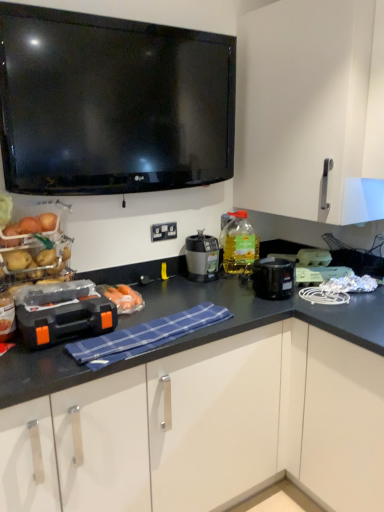
Question: In which direction should I rotate to look at orange plastic toolbox at center, which is counted as the first appliance, starting from the front?

Choices:
 (A) right
 (B) left

Answer: (B)

Question: Does white plastic electric outlet at center come in front of green plastic toaster at center, positioned as the third appliance in left-to-right order?

Choices:
 (A) yes
 (B) no

Answer: (B)

Question: Is white plastic electric outlet at center thinner than green plastic toaster at center, placed as the 1th appliance when sorted from right to left?

Choices:
 (A) no
 (B) yes

Answer: (B)

Question: Is white plastic electric outlet at center turned away from green plastic toaster at center, acting as the second appliance starting from the front?

Choices:
 (A) no
 (B) yes

Answer: (A)

Question: Could you tell me if white plastic electric outlet at center is facing green plastic toaster at center, acting as the second appliance starting from the front?

Choices:
 (A) yes
 (B) no

Answer: (B)

Question: Can you confirm if white plastic electric outlet at center is shorter than green plastic toaster at center, placed as the 1th appliance when sorted from right to left?

Choices:
 (A) no
 (B) yes

Answer: (A)

Question: From the image's perspective, is white plastic electric outlet at center located above green plastic toaster at center, which ranks as the 2th appliance in back-to-front order?

Choices:
 (A) yes
 (B) no

Answer: (A)

Question: Does white plastic electric outlet at center touch blue checkered cloth at center?

Choices:
 (A) no
 (B) yes

Answer: (A)

Question: Does white plastic electric outlet at center lie in front of blue checkered cloth at center?

Choices:
 (A) no
 (B) yes

Answer: (A)

Question: Is white plastic electric outlet at center facing away from blue checkered cloth at center?

Choices:
 (A) no
 (B) yes

Answer: (A)

Question: From the image's perspective, would you say white plastic electric outlet at center is positioned over blue checkered cloth at center?

Choices:
 (A) no
 (B) yes

Answer: (B)

Question: Could you tell me if white plastic electric outlet at center is turned towards blue checkered cloth at center?

Choices:
 (A) no
 (B) yes

Answer: (A)

Question: Considering the relative sizes of white plastic electric outlet at center and blue checkered cloth at center in the image provided, is white plastic electric outlet at center shorter than blue checkered cloth at center?

Choices:
 (A) yes
 (B) no

Answer: (B)

Question: Is matte black blender at center oriented towards blue checkered cloth at center?

Choices:
 (A) yes
 (B) no

Answer: (B)